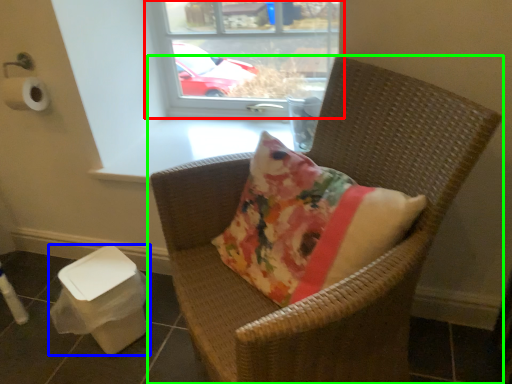
Question: Which object is the closest to the window (highlighted by a red box)? Choose among these: potty (highlighted by a blue box) or chair (highlighted by a green box).

Choices:
 (A) potty
 (B) chair

Answer: (B)